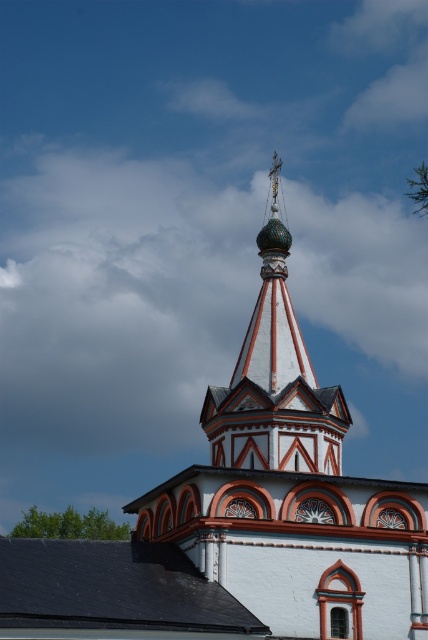
Question: Is white painted wood bell tower at center positioned before polished gold dome at center?

Choices:
 (A) yes
 (B) no

Answer: (A)

Question: Among these objects, which one is nearest to the camera?

Choices:
 (A) white painted wood bell tower at center
 (B) polished gold dome at center

Answer: (A)

Question: Which point appears closest to the camera in this image?

Choices:
 (A) (323, 451)
 (B) (308, 378)

Answer: (A)

Question: Can you confirm if white painted wood bell tower at center is positioned below polished gold dome at center?

Choices:
 (A) no
 (B) yes

Answer: (B)

Question: Does white painted wood bell tower at center have a larger size compared to polished gold dome at center?

Choices:
 (A) yes
 (B) no

Answer: (A)

Question: Which object appears farthest from the camera in this image?

Choices:
 (A) white painted wood bell tower at center
 (B) polished gold dome at center

Answer: (B)